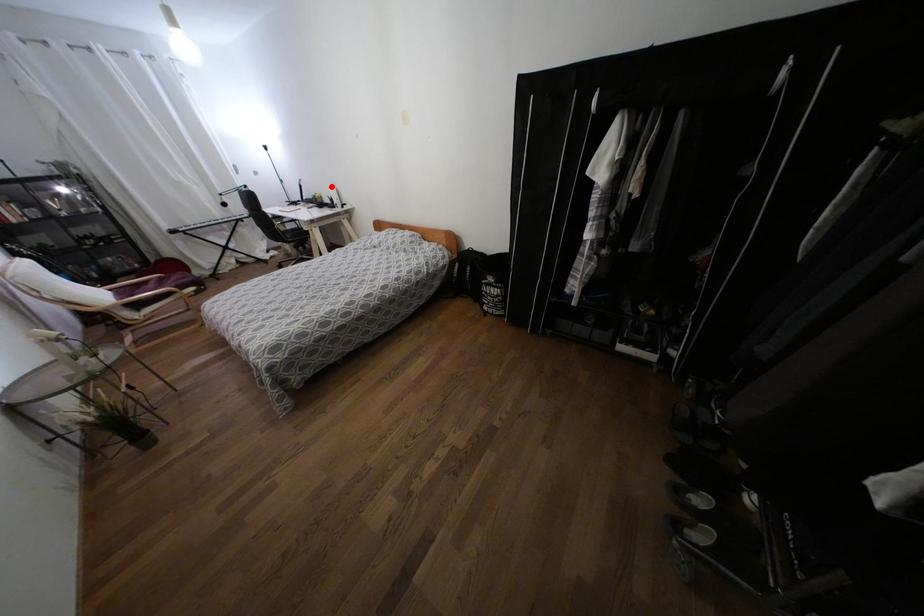
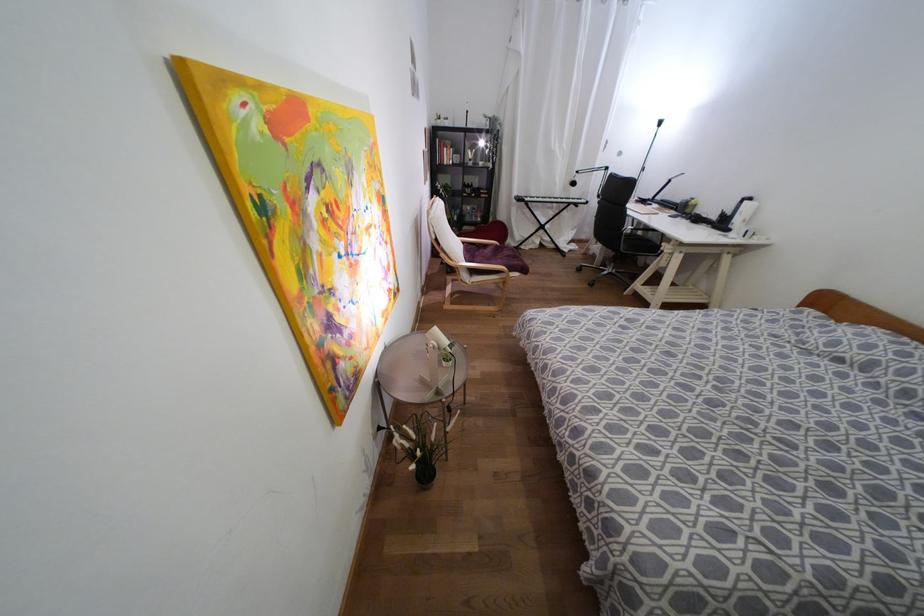
The point at the highlighted location is marked in the first image. Where is the corresponding point in the second image?

(749, 198)